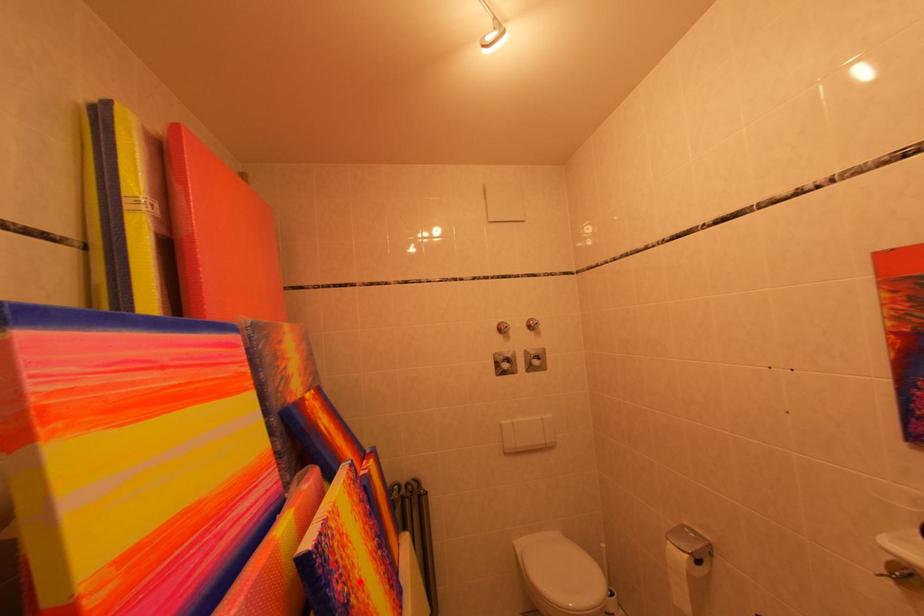
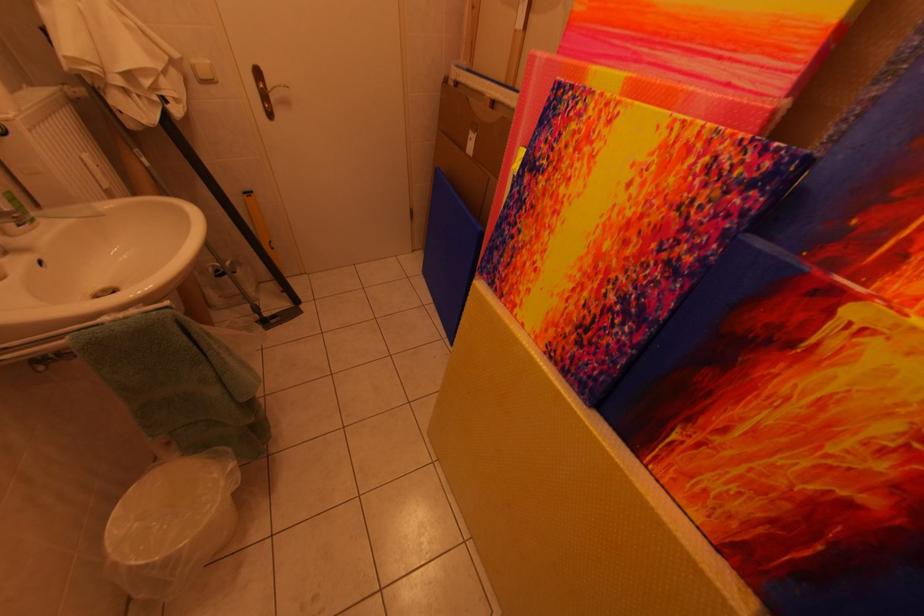
Locate, in the second image, the point that corresponds to the highlighted location in the first image.

(565, 180)